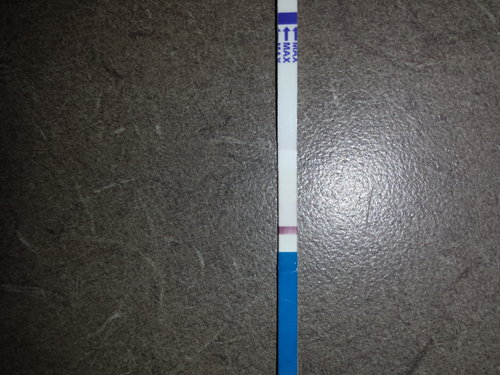
Where is `surface`? The image size is (500, 375). surface is located at coordinates (81, 181).